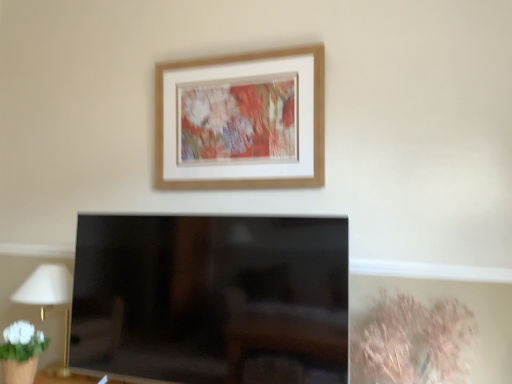
Question: From a real-world perspective, is dry grass at lower right under wooden picture frame at upper center?

Choices:
 (A) no
 (B) yes

Answer: (B)

Question: Is the surface of dry grass at lower right in direct contact with wooden picture frame at upper center?

Choices:
 (A) no
 (B) yes

Answer: (A)

Question: From the image's perspective, would you say dry grass at lower right is shown under wooden picture frame at upper center?

Choices:
 (A) yes
 (B) no

Answer: (A)

Question: Does dry grass at lower right have a greater height compared to wooden picture frame at upper center?

Choices:
 (A) yes
 (B) no

Answer: (B)

Question: Is dry grass at lower right oriented towards wooden picture frame at upper center?

Choices:
 (A) yes
 (B) no

Answer: (B)

Question: Does point pyautogui.click(x=439, y=324) appear closer or farther from the camera than point pyautogui.click(x=224, y=99)?

Choices:
 (A) farther
 (B) closer

Answer: (B)

Question: Considering the relative positions of dry grass at lower right and wooden picture frame at upper center in the image provided, is dry grass at lower right to the left or to the right of wooden picture frame at upper center?

Choices:
 (A) left
 (B) right

Answer: (B)

Question: From the image's perspective, is dry grass at lower right positioned above or below wooden picture frame at upper center?

Choices:
 (A) above
 (B) below

Answer: (B)

Question: In the image, is dry grass at lower right positioned in front of or behind wooden picture frame at upper center?

Choices:
 (A) front
 (B) behind

Answer: (A)

Question: From the image's perspective, relative to white fabric lampshade at left, is wooden picture frame at upper center above or below?

Choices:
 (A) below
 (B) above

Answer: (B)

Question: In the image, is wooden picture frame at upper center positioned in front of or behind white fabric lampshade at left?

Choices:
 (A) behind
 (B) front

Answer: (B)

Question: Considering the relative positions of wooden picture frame at upper center and white fabric lampshade at left in the image provided, is wooden picture frame at upper center to the left or to the right of white fabric lampshade at left?

Choices:
 (A) right
 (B) left

Answer: (A)

Question: Would you say wooden picture frame at upper center is inside or outside white fabric lampshade at left?

Choices:
 (A) inside
 (B) outside

Answer: (B)

Question: Is white fabric lampshade at left bigger or smaller than wooden picture frame at upper center?

Choices:
 (A) big
 (B) small

Answer: (A)

Question: Visually, is white fabric lampshade at left positioned to the left or to the right of wooden picture frame at upper center?

Choices:
 (A) right
 (B) left

Answer: (B)